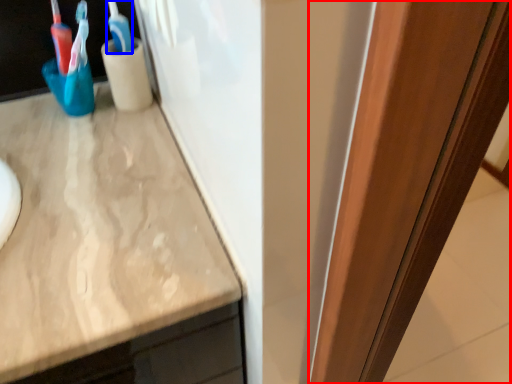
Question: Which point is closer to the camera, glass door (highlighted by a red box) or toothbrush (highlighted by a blue box)?

Choices:
 (A) glass door
 (B) toothbrush

Answer: (A)